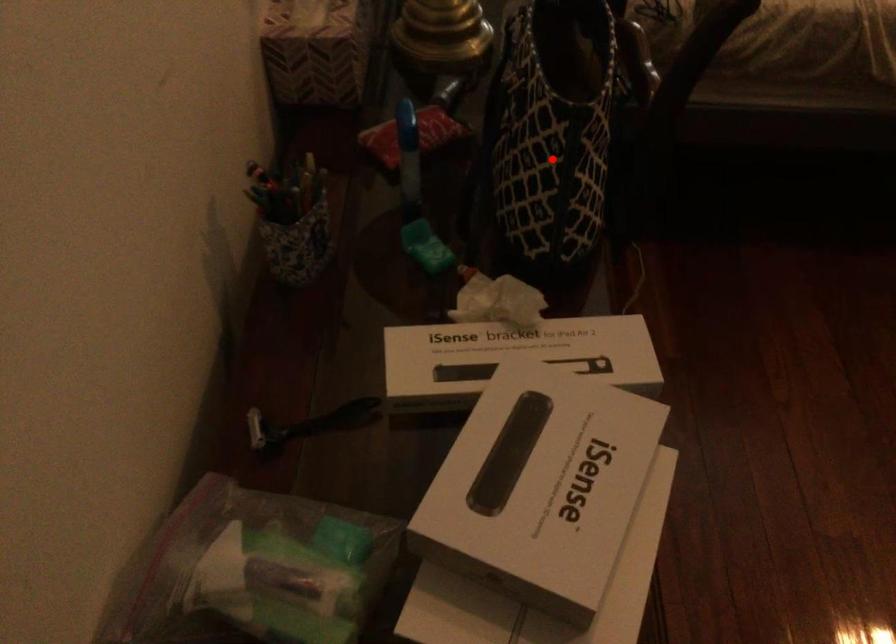
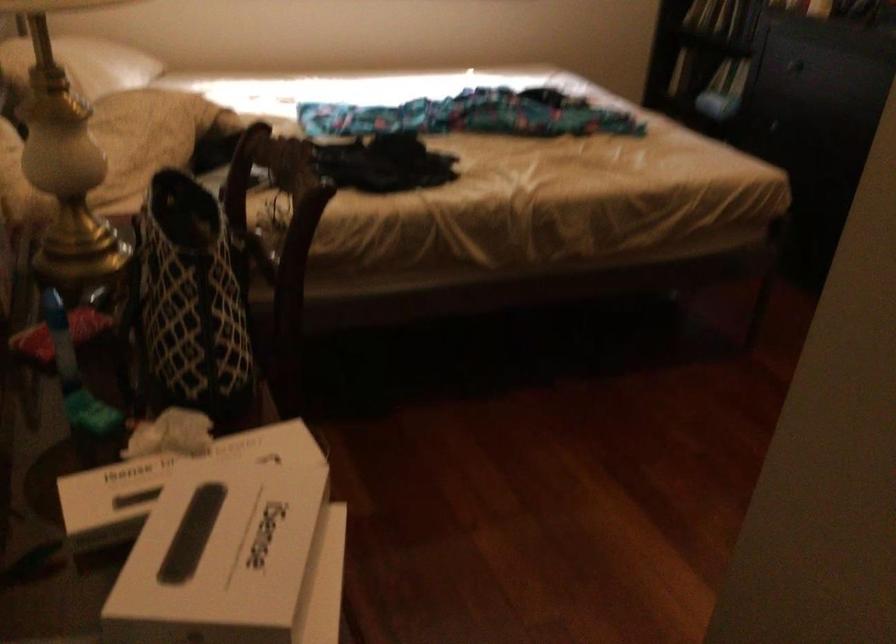
In the second image, find the point that corresponds to the highlighted location in the first image.

(188, 301)